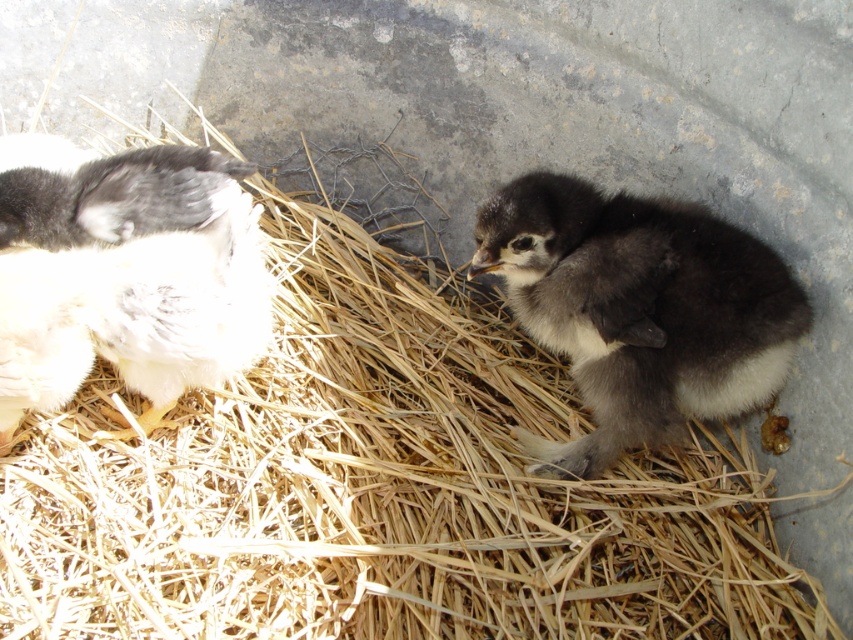
Question: Does white fluffy chicken at left have a smaller size compared to dark gray fluffy chick at center?

Choices:
 (A) yes
 (B) no

Answer: (A)

Question: Is white fluffy chicken at left positioned before dark gray fluffy chick at center?

Choices:
 (A) no
 (B) yes

Answer: (B)

Question: Which of the following is the closest to the observer?

Choices:
 (A) dark gray fluffy chick at center
 (B) white fluffy chicken at left

Answer: (B)

Question: Is the position of white fluffy chicken at left more distant than that of dark gray fluffy chick at center?

Choices:
 (A) yes
 (B) no

Answer: (B)

Question: Which point is farther from the camera taking this photo?

Choices:
 (A) (173, 173)
 (B) (776, 332)

Answer: (B)